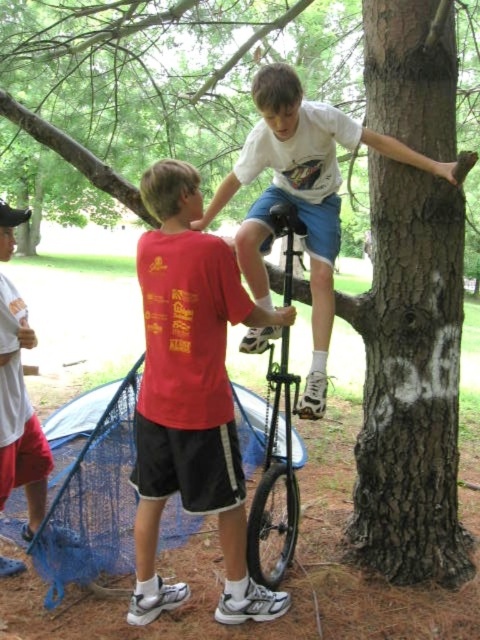
Question: Among these objects, which one is farthest from the camera?

Choices:
 (A) white cotton shirt at center
 (B) white matte/uniform shirt at upper center
 (C) matte red t-shirt at center
 (D) black matte unicycle at center

Answer: (A)

Question: Does white matte/uniform shirt at upper center appear on the right side of white cotton shirt at center?

Choices:
 (A) yes
 (B) no

Answer: (A)

Question: Which of the following is the farthest from the observer?

Choices:
 (A) (25, 436)
 (B) (252, 576)
 (C) (180, 452)
 (D) (325, 211)

Answer: (D)

Question: Which point appears farthest from the camera in this image?

Choices:
 (A) (33, 531)
 (B) (190, 364)
 (C) (265, 224)

Answer: (A)

Question: Can you confirm if matte red t-shirt at center is positioned below white matte/uniform shirt at upper center?

Choices:
 (A) yes
 (B) no

Answer: (A)

Question: Does white matte/uniform shirt at upper center appear under white cotton shirt at center?

Choices:
 (A) no
 (B) yes

Answer: (A)